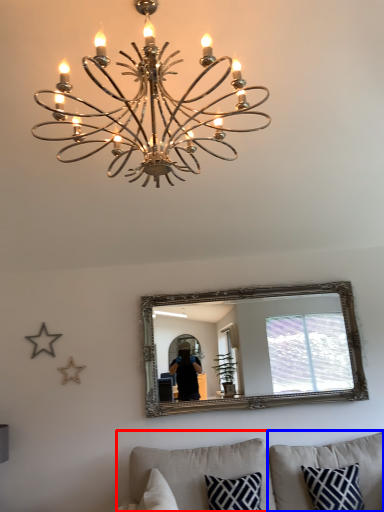
Question: Which object is further to the camera taking this photo, studio couch (highlighted by a red box) or pillow (highlighted by a blue box)?

Choices:
 (A) studio couch
 (B) pillow

Answer: (B)